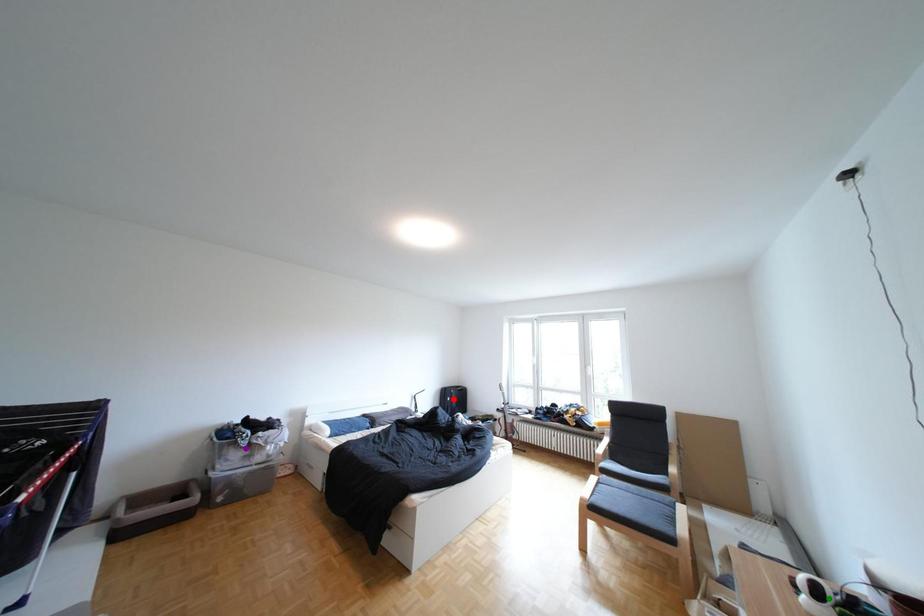
Order these from nearest to farthest:
- green point
- red point
- purple point

green point, purple point, red point